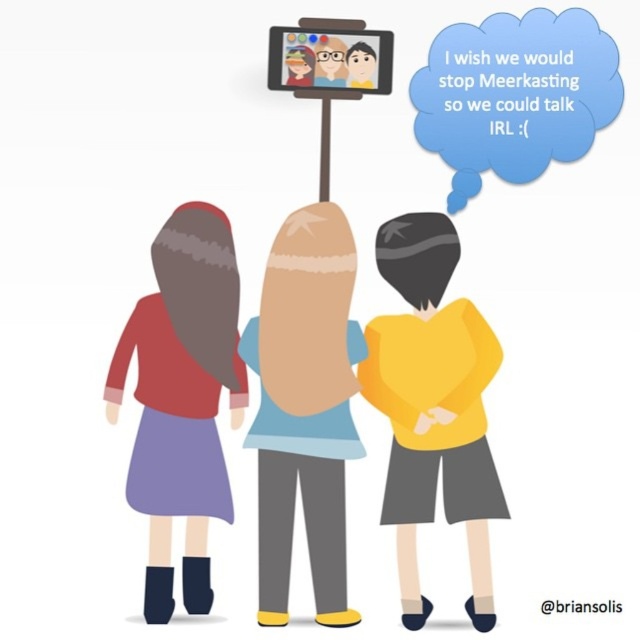
Question: Is matte red sweater at left closer to camera compared to blue paper speech bubble at upper center?

Choices:
 (A) yes
 (B) no

Answer: (A)

Question: Which is farther from the smooth beige hair at center?

Choices:
 (A) blue paper speech bubble at upper center
 (B) matte red sweater at left

Answer: (A)

Question: Which object is positioned closest to the matte red sweater at left?

Choices:
 (A) blue paper speech bubble at upper center
 (B) yellow matte shirt at center
 (C) matte plastic tablet at upper center

Answer: (B)

Question: Among these objects, which one is farthest from the camera?

Choices:
 (A) smooth beige hair at center
 (B) matte plastic tablet at upper center
 (C) matte red sweater at left
 (D) blue paper speech bubble at upper center

Answer: (B)

Question: Does yellow matte shirt at center have a lesser width compared to smooth beige hair at center?

Choices:
 (A) no
 (B) yes

Answer: (A)

Question: From the image, what is the correct spatial relationship of yellow matte shirt at center in relation to matte plastic tablet at upper center?

Choices:
 (A) right
 (B) left

Answer: (A)